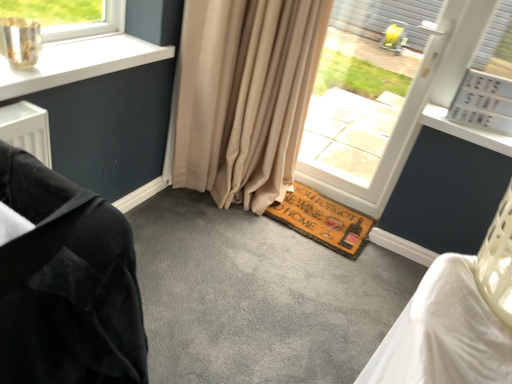
In order to face brown coir doormat at lower center, should I rotate leftwards or rightwards?

You should look right and rotate roughly 5.430 degrees.

Image resolution: width=512 pixels, height=384 pixels. What do you see at coordinates (245, 96) in the screenshot?
I see `beige fabric curtain at center` at bounding box center [245, 96].

The image size is (512, 384). Describe the element at coordinates (414, 103) in the screenshot. I see `white plastic window at center` at that location.

Where is `brown coir doormat at lower center`? brown coir doormat at lower center is located at coordinates (323, 220).

Is velvet black armchair at left further to camera compared to brown coir doormat at lower center?

No, velvet black armchair at left is in front of brown coir doormat at lower center.

In the scene shown: From a real-world perspective, is velvet black armchair at left positioned under brown coir doormat at lower center based on gravity?

No.

Considering the relative positions of velvet black armchair at left and brown coir doormat at lower center in the image provided, is velvet black armchair at left to the left of brown coir doormat at lower center from the viewer's perspective?

Yes, velvet black armchair at left is to the left of brown coir doormat at lower center.

Is beige fabric curtain at center smaller than velvet black armchair at left?

No, beige fabric curtain at center is not smaller than velvet black armchair at left.

Which is in front, point (268, 22) or point (70, 343)?

Positioned in front is point (70, 343).

Can you confirm if white plastic window at center is wider than brown coir doormat at lower center?

Incorrect, the width of white plastic window at center does not surpass that of brown coir doormat at lower center.

You are a GUI agent. You are given a task and a screenshot of the screen. Output one action in this format:
    pyautogui.click(x=<x>, y=<y>)
    Task: Click on the doormat behind the white plastic window at center
    The height and width of the screenshot is (384, 512).
    Given the screenshot: What is the action you would take?
    pyautogui.click(x=323, y=220)

Considering the positions of objects white plastic window at center and brown coir doormat at lower center in the image provided, who is more to the left, white plastic window at center or brown coir doormat at lower center?

brown coir doormat at lower center is more to the left.

Which is in front, point (439, 93) or point (306, 235)?

The point (439, 93) is more forward.

Is white plastic window at center in front of or behind beige fabric curtain at center in the image?

Clearly, white plastic window at center is behind beige fabric curtain at center.

How many degrees apart are the facing directions of white plastic window at center and beige fabric curtain at center?

Result: The facing directions of white plastic window at center and beige fabric curtain at center are 0.983 degrees apart.

Considering the sizes of objects white plastic window at center and beige fabric curtain at center in the image provided, who is taller, white plastic window at center or beige fabric curtain at center?

white plastic window at center.

From the image's perspective, is white plastic window at center positioned above or below beige fabric curtain at center?

white plastic window at center is situated higher than beige fabric curtain at center in the image.

Is brown coir doormat at lower center wider than velvet black armchair at left?

No, brown coir doormat at lower center is not wider than velvet black armchair at left.

How different are the orientations of brown coir doormat at lower center and velvet black armchair at left in degrees?

There is a 87.3-degree angle between the facing directions of brown coir doormat at lower center and velvet black armchair at left.

Considering the sizes of objects brown coir doormat at lower center and velvet black armchair at left in the image provided, who is shorter, brown coir doormat at lower center or velvet black armchair at left?

brown coir doormat at lower center.

Considering the relative sizes of brown coir doormat at lower center and velvet black armchair at left in the image provided, is brown coir doormat at lower center smaller than velvet black armchair at left?

Correct, brown coir doormat at lower center occupies less space than velvet black armchair at left.

Consider the image. From the image's perspective, between brown coir doormat at lower center and white plastic window at center, which one is located above?

white plastic window at center, from the image's perspective.

Between brown coir doormat at lower center and white plastic window at center, which one has larger width?

With larger width is brown coir doormat at lower center.

Is brown coir doormat at lower center completely or partially outside of white plastic window at center?

brown coir doormat at lower center is positioned outside white plastic window at center.

Considering the relative sizes of brown coir doormat at lower center and white plastic window at center in the image provided, is brown coir doormat at lower center taller than white plastic window at center?

In fact, brown coir doormat at lower center may be shorter than white plastic window at center.

Could you tell me if velvet black armchair at left is turned towards beige fabric curtain at center?

No, velvet black armchair at left is not facing towards beige fabric curtain at center.

From the image's perspective, does velvet black armchair at left appear lower than beige fabric curtain at center?

Correct, velvet black armchair at left appears lower than beige fabric curtain at center in the image.

Which object is positioned more to the left, velvet black armchair at left or beige fabric curtain at center?

velvet black armchair at left is more to the left.

Between velvet black armchair at left and beige fabric curtain at center, which one is positioned behind?

beige fabric curtain at center is further from the camera.

I want to click on furniture below the brown coir doormat at lower center (from the image's perspective), so click(67, 283).

There is a velvet black armchair at left. Where is `curtain above it (from a real-world perspective)`? curtain above it (from a real-world perspective) is located at coordinates (245, 96).

From the image, which object appears to be nearer to velvet black armchair at left, white plastic window at center or brown coir doormat at lower center?

brown coir doormat at lower center is positioned closer to the anchor velvet black armchair at left.

From the image, which object appears to be farther from beige fabric curtain at center, velvet black armchair at left or brown coir doormat at lower center?

velvet black armchair at left lies further to beige fabric curtain at center than the other object.

Considering their positions, is beige fabric curtain at center positioned further to brown coir doormat at lower center than white plastic window at center?

Based on the image, beige fabric curtain at center appears to be further to brown coir doormat at lower center.

Considering their positions, is brown coir doormat at lower center positioned closer to velvet black armchair at left than beige fabric curtain at center?

→ The object closer to velvet black armchair at left is beige fabric curtain at center.

When comparing their distances from brown coir doormat at lower center, does velvet black armchair at left or beige fabric curtain at center seem further?

Based on the image, velvet black armchair at left appears to be further to brown coir doormat at lower center.

Looking at the image, which one is located closer to white plastic window at center, brown coir doormat at lower center or beige fabric curtain at center?

Among the two, brown coir doormat at lower center is located nearer to white plastic window at center.

Based on their spatial positions, is brown coir doormat at lower center or velvet black armchair at left further from white plastic window at center?

Based on the image, velvet black armchair at left appears to be further to white plastic window at center.

When comparing their distances from beige fabric curtain at center, does white plastic window at center or velvet black armchair at left seem closer?

The object closer to beige fabric curtain at center is white plastic window at center.

Where is `curtain between velvet black armchair at left and brown coir doormat at lower center in the front-back direction`? The image size is (512, 384). curtain between velvet black armchair at left and brown coir doormat at lower center in the front-back direction is located at coordinates (245, 96).

Where is `curtain between velvet black armchair at left and white plastic window at center from front to back`? This screenshot has width=512, height=384. curtain between velvet black armchair at left and white plastic window at center from front to back is located at coordinates (245, 96).

This screenshot has width=512, height=384. In order to click on window positioned between velvet black armchair at left and brown coir doormat at lower center from near to far in this screenshot , I will do click(x=414, y=103).

Identify the location of curtain between white plastic window at center and brown coir doormat at lower center in the vertical direction. (245, 96).